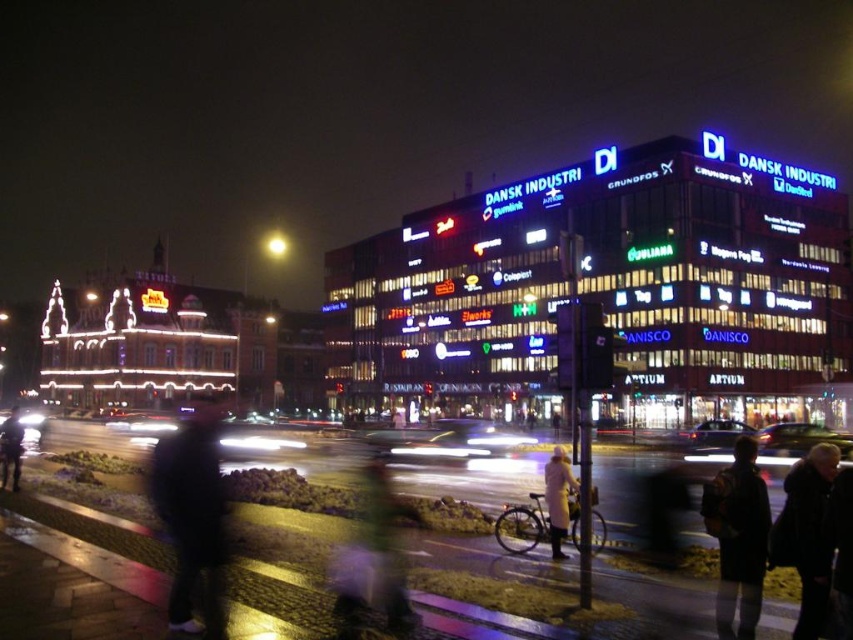
Question: In this image, where is black matte jacket at lower right located relative to light beige coat at center?

Choices:
 (A) right
 (B) left

Answer: (A)

Question: Is green fabric jacket at center to the right of black matte jacket at lower right from the viewer's perspective?

Choices:
 (A) no
 (B) yes

Answer: (A)

Question: Which of the following is the farthest from the observer?

Choices:
 (A) (801, 593)
 (B) (560, 538)
 (C) (363, 580)

Answer: (B)

Question: Which object appears farthest from the camera in this image?

Choices:
 (A) light beige coat at center
 (B) green fabric jacket at center
 (C) dark blue jacket at lower left
 (D) dark fabric jacket at lower left

Answer: (C)

Question: Which point is closer to the camera taking this photo?

Choices:
 (A) (221, 488)
 (B) (547, 490)
 (C) (799, 564)
 (D) (7, 460)

Answer: (C)

Question: Can you confirm if green fabric jacket at center is positioned to the left of light beige coat at center?

Choices:
 (A) no
 (B) yes

Answer: (B)